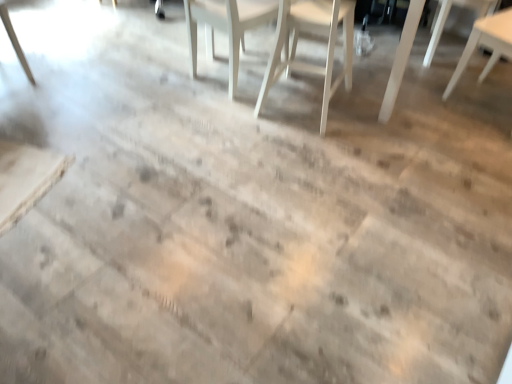
I want to click on free region under white wood chair at center, the first chair when ordered from left to right (from a real-world perspective), so click(x=221, y=77).